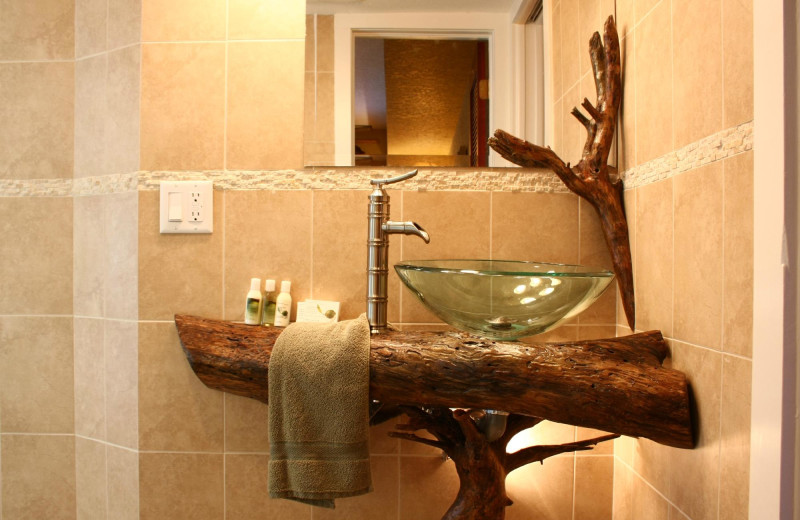
At what (x,y) coordinates should I click in order to perform the action: click on light switch. Please return your answer as a coordinate pair (x, y). The image size is (800, 520). Looking at the image, I should click on (172, 211).